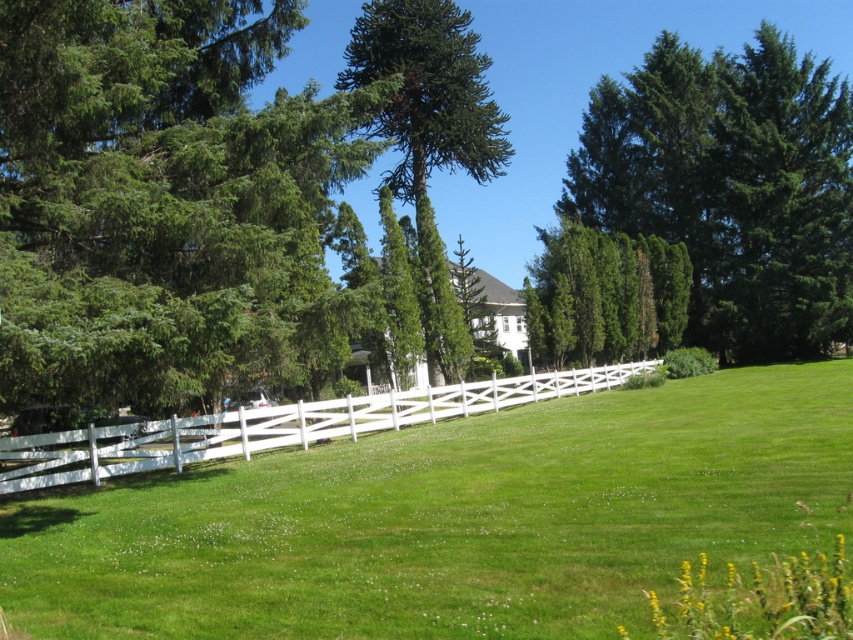
Consider the image. Between green grassy field at center and white wooden fence at lower center, which one appears on the left side from the viewer's perspective?

white wooden fence at lower center

Does point (718, 476) lie in front of point (633, 365)?

Yes, it is in front of point (633, 365).

Does point (715, 518) come closer to viewer compared to point (502, 397)?

That is True.

This screenshot has width=853, height=640. In order to click on green grassy field at center in this screenshot , I will do `click(450, 518)`.

Is point (631, 120) farther from camera compared to point (633, 260)?

Yes, point (631, 120) is behind point (633, 260).

Identify the location of green textured tree at upper right. (730, 188).

Does point (51, 592) come farther from viewer compared to point (585, 145)?

No, it is in front of (585, 145).

Does green grassy field at center appear under green textured tree at upper right?

Yes, green grassy field at center is below green textured tree at upper right.

Is point (590, 493) closer to camera compared to point (640, 156)?

That is True.

You are a GUI agent. You are given a task and a screenshot of the screen. Output one action in this format:
    pyautogui.click(x=<x>, y=<y>)
    Task: Click on the green grassy field at center
    This screenshot has height=640, width=853.
    Given the screenshot: What is the action you would take?
    pyautogui.click(x=450, y=518)